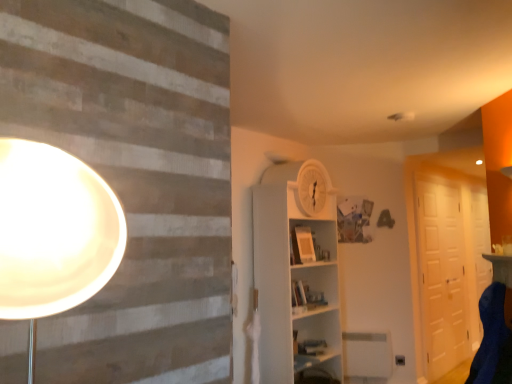
Describe the element at coordinates (295, 274) in the screenshot. I see `white wooden shelf at center` at that location.

What is the approximate width of blue fabric swivel chair at lower right?

It is 15.19 inches.

Describe the element at coordinates (493, 340) in the screenshot. The image size is (512, 384). I see `blue fabric swivel chair at lower right` at that location.

What are the coordinates of `white matte barn door at right` in the screenshot? It's located at click(441, 274).

The height and width of the screenshot is (384, 512). What do you see at coordinates (480, 237) in the screenshot?
I see `white glossy door at right` at bounding box center [480, 237].

Measure the distance between white glossy door at right and camera.

A distance of 4.81 meters exists between white glossy door at right and camera.

Identify the location of white wooden shelf at center. pos(295,274).

From a real-world perspective, is white glossy door at right below blue fabric swivel chair at lower right?

No, from a real-world perspective, white glossy door at right is not under blue fabric swivel chair at lower right.

Is point (488, 268) positioned before point (498, 325)?

No, it is not.

In the scene shown: Which of these two, white glossy door at right or blue fabric swivel chair at lower right, stands taller?

Standing taller between the two is white glossy door at right.

Relative to blue fabric swivel chair at lower right, is white glossy door at right in front or behind?

Clearly, white glossy door at right is behind blue fabric swivel chair at lower right.

How distant is white glossy door at right from white matte barn door at right?

white glossy door at right is 22.20 inches from white matte barn door at right.

Is white glossy door at right shorter than white matte barn door at right?

Correct, white glossy door at right is not as tall as white matte barn door at right.

From a real-world perspective, who is located higher, white glossy door at right or white matte barn door at right?

In real-world perspective, white glossy door at right is above.

Based on the photo, considering the positions of objects white glossy door at right and white matte barn door at right in the image provided, who is behind, white glossy door at right or white matte barn door at right?

white glossy door at right is further from the camera.

Considering the relative sizes of white matte barn door at right and matte white table at right in the image provided, is white matte barn door at right wider than matte white table at right?

Indeed, white matte barn door at right has a greater width compared to matte white table at right.

How many degrees apart are the facing directions of white matte barn door at right and matte white table at right?

134 degrees.

The height and width of the screenshot is (384, 512). What are the coordinates of `table located in front of the white matte barn door at right` in the screenshot? It's located at (500, 268).

Considering the relative sizes of white wooden shelf at center and white glossy door at right in the image provided, is white wooden shelf at center taller than white glossy door at right?

Yes, white wooden shelf at center is taller than white glossy door at right.

From a real-world perspective, which object stands above the other?

In real-world perspective, white wooden shelf at center is above.

From the image's perspective, relative to white glossy door at right, is white wooden shelf at center above or below?

From the image's perspective, white wooden shelf at center appears above white glossy door at right.

At what (x,y) coordinates should I click in order to perform the action: click on shelf above the white glossy door at right (from a real-world perspective). Please return your answer as a coordinate pair (x, y). Looking at the image, I should click on (295, 274).

From a real-world perspective, is blue fabric swivel chair at lower right physically below white glossy door at right?

Yes.

This screenshot has height=384, width=512. I want to click on swivel chair below the white glossy door at right (from a real-world perspective), so click(x=493, y=340).

Is blue fabric swivel chair at lower right positioned with its back to white glossy door at right?

No, blue fabric swivel chair at lower right is not facing the opposite direction of white glossy door at right.

Image resolution: width=512 pixels, height=384 pixels. Find the location of `door on the right of the matte white table at right`. door on the right of the matte white table at right is located at coordinates (480, 237).

Considering the relative sizes of matte white table at right and white glossy door at right in the image provided, is matte white table at right smaller than white glossy door at right?

Yes.

Is white glossy door at right inside matte white table at right?

No, matte white table at right does not contain white glossy door at right.

From a real-world perspective, is matte white table at right physically below white glossy door at right?

No, from a real-world perspective, matte white table at right is not below white glossy door at right.

Is there a large distance between blue fabric swivel chair at lower right and white wooden shelf at center?

Indeed, blue fabric swivel chair at lower right is not near white wooden shelf at center.

Which of these two, blue fabric swivel chair at lower right or white wooden shelf at center, stands taller?

Standing taller between the two is white wooden shelf at center.

Is blue fabric swivel chair at lower right facing away from white wooden shelf at center?

No, blue fabric swivel chair at lower right is not facing the opposite direction of white wooden shelf at center.

This screenshot has width=512, height=384. Identify the location of door that appears behind the blue fabric swivel chair at lower right. (480, 237).

The width and height of the screenshot is (512, 384). In order to click on door on the right of white matte barn door at right in this screenshot , I will do `click(480, 237)`.

Which object lies nearer to the anchor point blue fabric swivel chair at lower right, white matte barn door at right or white glossy door at right?

white matte barn door at right is positioned closer to the anchor blue fabric swivel chair at lower right.

Looking at the image, which one is located further to white wooden shelf at center, blue fabric swivel chair at lower right or white matte barn door at right?

Among the two, white matte barn door at right is located further to white wooden shelf at center.

Considering their positions, is white wooden shelf at center positioned closer to blue fabric swivel chair at lower right than white matte barn door at right?

Among the two, white wooden shelf at center is located nearer to blue fabric swivel chair at lower right.

From the image, which object appears to be farther from white glossy door at right, matte white table at right or white wooden shelf at center?

white wooden shelf at center is positioned further to the anchor white glossy door at right.

Considering their positions, is white glossy door at right positioned further to blue fabric swivel chair at lower right than matte white table at right?

white glossy door at right is further to blue fabric swivel chair at lower right.

Based on their spatial positions, is blue fabric swivel chair at lower right or white glossy door at right further from white wooden shelf at center?

white glossy door at right is positioned further to the anchor white wooden shelf at center.

Which object lies further to the anchor point white glossy door at right, blue fabric swivel chair at lower right or white matte barn door at right?

Based on the image, blue fabric swivel chair at lower right appears to be further to white glossy door at right.

Based on their spatial positions, is white matte barn door at right or blue fabric swivel chair at lower right closer to white wooden shelf at center?

blue fabric swivel chair at lower right lies closer to white wooden shelf at center than the other object.

Identify the location of table between blue fabric swivel chair at lower right and white glossy door at right along the z-axis. The image size is (512, 384). (500, 268).

I want to click on swivel chair between white wooden shelf at center and matte white table at right, so click(x=493, y=340).

You are a GUI agent. You are given a task and a screenshot of the screen. Output one action in this format:
    pyautogui.click(x=<x>, y=<y>)
    Task: Click on the shelf between matte white table at right and white glossy door at right from front to back
    Image resolution: width=512 pixels, height=384 pixels.
    Given the screenshot: What is the action you would take?
    pyautogui.click(x=295, y=274)

Where is `table between blue fabric swivel chair at lower right and white matte barn door at right from front to back`? This screenshot has height=384, width=512. table between blue fabric swivel chair at lower right and white matte barn door at right from front to back is located at coordinates (500, 268).